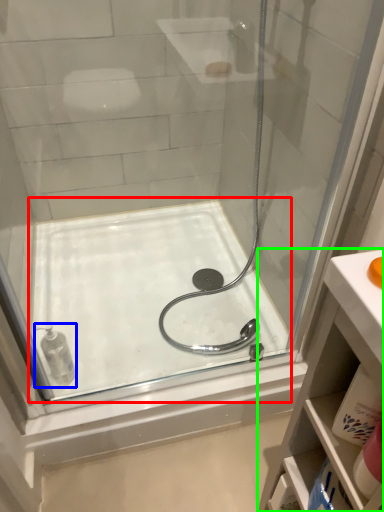
Question: Which object is the farthest from bath (highlighted by a red box)? Choose among these: toiletry (highlighted by a blue box) or bathroom cabinet (highlighted by a green box).

Choices:
 (A) toiletry
 (B) bathroom cabinet

Answer: (B)